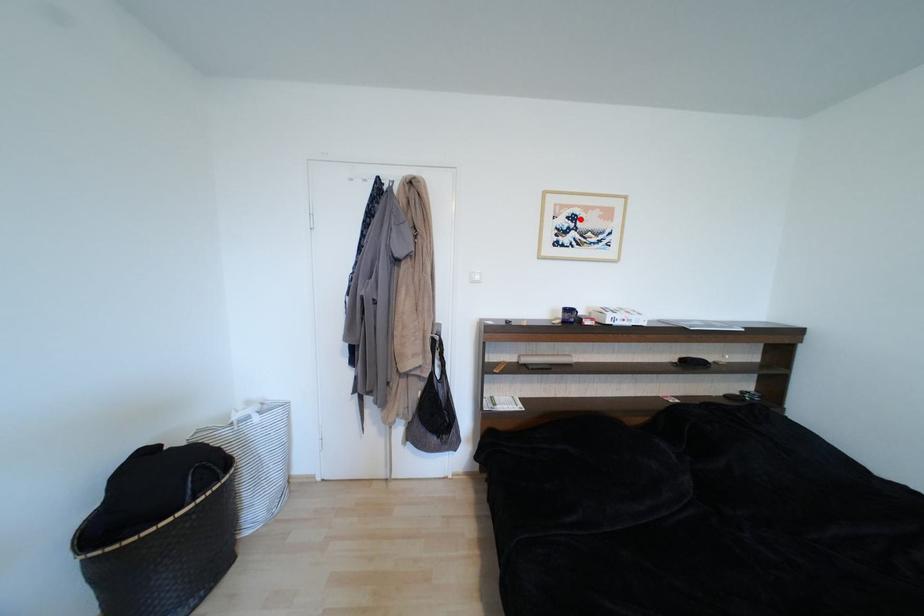
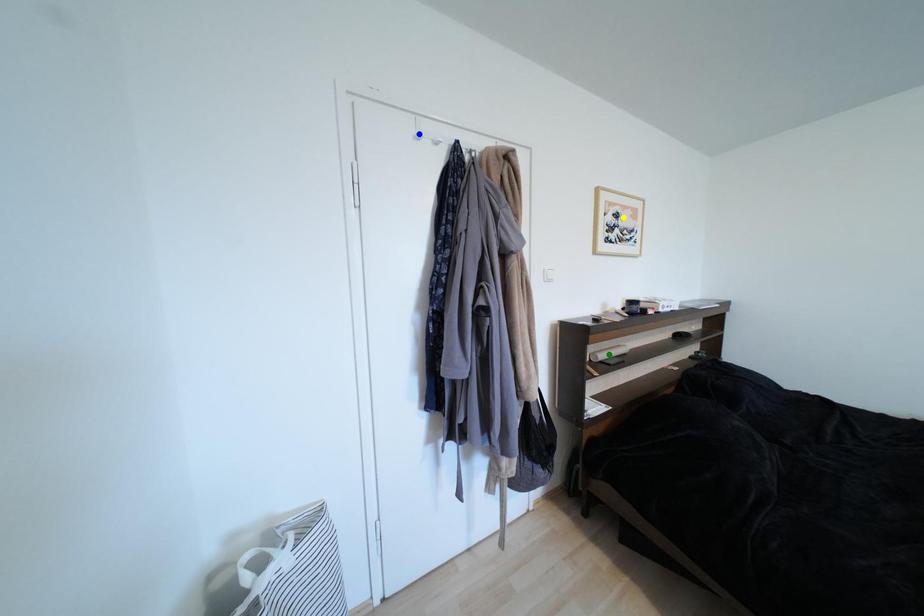
Question: I am providing you with two images of the same scene from different viewpoints. A red point is marked on the first image. You are given multiple points on the second image. Which spot in image 2 lines up with the point in image 1?

Choices:
 (A) yellow point
 (B) green point
 (C) blue point

Answer: (A)